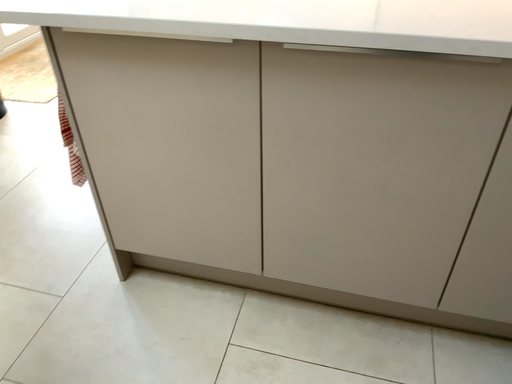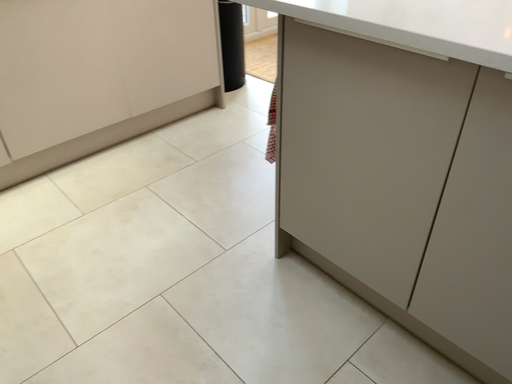
Question: Which way did the camera rotate in the video?

Choices:
 (A) rotated left
 (B) rotated right

Answer: (A)